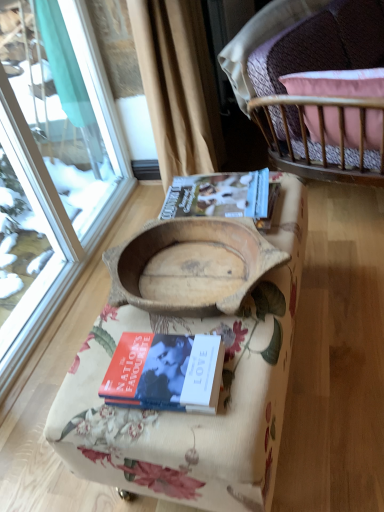
You are a GUI agent. You are given a task and a screenshot of the screen. Output one action in this format:
    pyautogui.click(x=<x>, y=<y>)
    Task: Click on the vacant space in front of hardcover book at center, arranged as the second book when viewed from the back
    
    Given the screenshot: What is the action you would take?
    pyautogui.click(x=183, y=434)